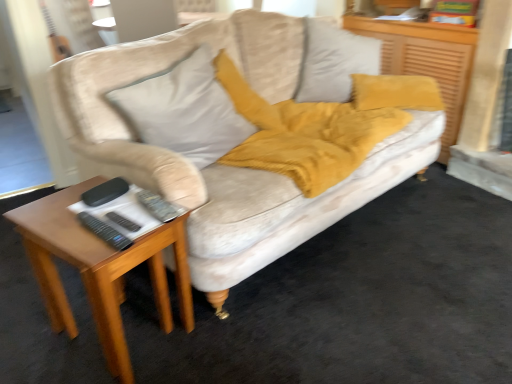
The image size is (512, 384). I want to click on space that is in front of black plastic remote at lower left, which is counted as the first remote, starting from the front, so click(x=92, y=251).